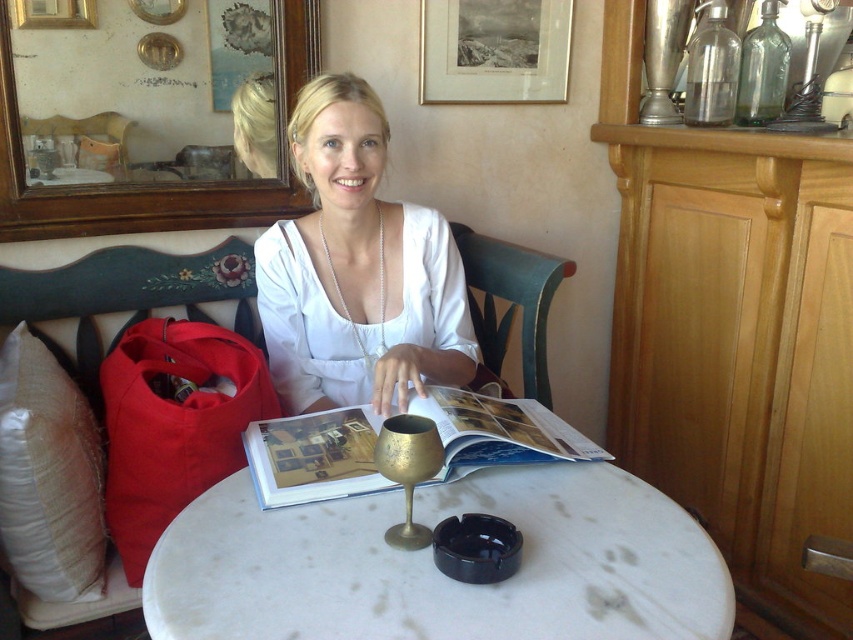
Question: Does matte gold magazine at center lie in front of gold-framed print at upper center?

Choices:
 (A) no
 (B) yes

Answer: (B)

Question: Which point is farther from the camera taking this photo?

Choices:
 (A) (38, 26)
 (B) (646, 589)
 (C) (436, 444)

Answer: (A)

Question: Which of the following is the closest to the observer?

Choices:
 (A) gold-framed print at upper center
 (B) white fabric shirt at center

Answer: (B)

Question: Is white marble table at center wider than gold metallic wine glass at center?

Choices:
 (A) yes
 (B) no

Answer: (A)

Question: Which object is the closest to the matte gold magazine at center?

Choices:
 (A) gold-framed print at upper center
 (B) gold metallic wine glass at center

Answer: (B)

Question: Does matte gold magazine at center appear on the right side of gold metallic wine glass at center?

Choices:
 (A) no
 (B) yes

Answer: (B)